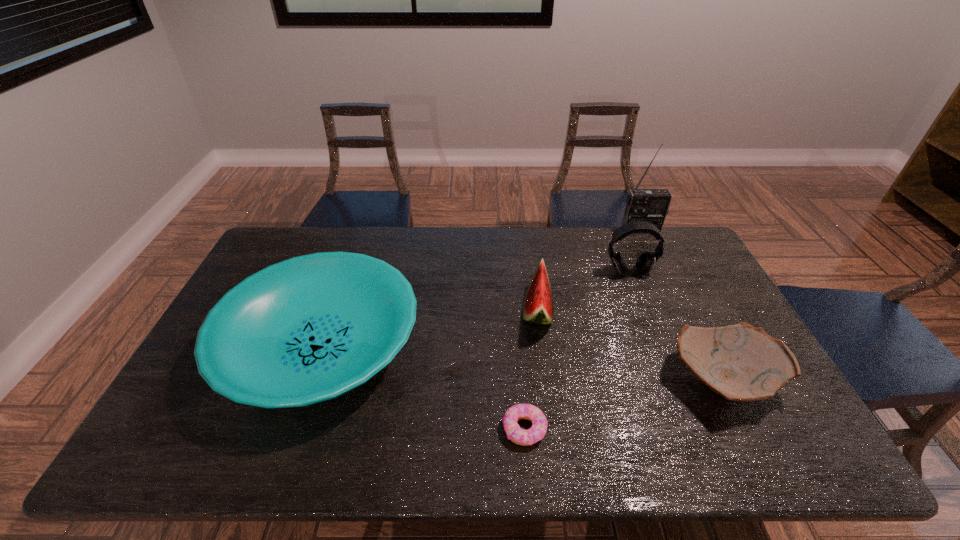
Find the location of a particular element. This screenshot has width=960, height=540. vacant space located 0.090m on the outer rind of the watermelon is located at coordinates (492, 312).

You are a GUI agent. You are given a task and a screenshot of the screen. Output one action in this format:
    pyautogui.click(x=<x>, y=<y>)
    Task: Click on the vacant position located on the outer rind of the watermelon
    
    Given the screenshot: What is the action you would take?
    pyautogui.click(x=476, y=312)

Image resolution: width=960 pixels, height=540 pixels. What are the coordinates of `free region located on the outer rind of the watermelon` in the screenshot? It's located at (456, 312).

The width and height of the screenshot is (960, 540). What are the coordinates of `vacant space situated 0.200m on the back of the dish` in the screenshot? It's located at (357, 245).

Locate an element on the screen. This screenshot has height=540, width=960. free space located 0.330m on the left of the pottery is located at coordinates (543, 381).

I want to click on free space located on the right of the doughnut, so click(606, 429).

This screenshot has height=540, width=960. What are the coordinates of `radio receiver located in the far edge section of the desktop` in the screenshot? It's located at (649, 205).

I want to click on earphone present at the far edge, so click(645, 262).

The height and width of the screenshot is (540, 960). What are the coordinates of `dish that is at the near edge` in the screenshot? It's located at (308, 329).

Locate an element on the screen. doughnut that is positioned at the near edge is located at coordinates (517, 435).